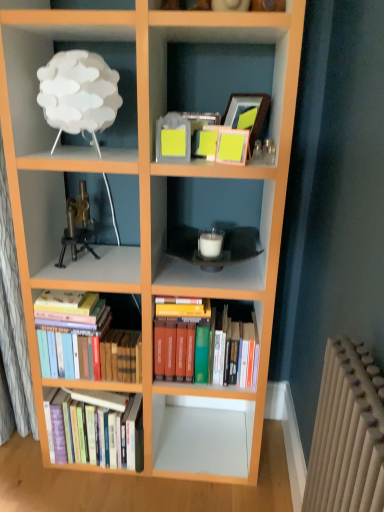
Question: Is hardcover books at lower left, arranged as the third book when viewed from the right, closer to camera compared to hardcover books at center, the third book positioned from the left?

Choices:
 (A) no
 (B) yes

Answer: (A)

Question: Does hardcover books at lower left, arranged as the third book when viewed from the right, have a larger size compared to hardcover books at center, the first book viewed from the right?

Choices:
 (A) no
 (B) yes

Answer: (A)

Question: Is hardcover books at lower left, the first book positioned from the left, not near hardcover books at center, the first book viewed from the right?

Choices:
 (A) yes
 (B) no

Answer: (B)

Question: From the image's perspective, does hardcover books at lower left, the first book positioned from the left, appear lower than hardcover books at center, the first book viewed from the right?

Choices:
 (A) yes
 (B) no

Answer: (A)

Question: From the image's perspective, would you say hardcover books at lower left, arranged as the third book when viewed from the right, is positioned over hardcover books at center, the third book positioned from the left?

Choices:
 (A) yes
 (B) no

Answer: (B)

Question: From a real-world perspective, is white matte lamp at upper left positioned above or below hardcover books at lower left, the first book positioned from the left?

Choices:
 (A) above
 (B) below

Answer: (A)

Question: Looking at the image, does white matte lamp at upper left seem bigger or smaller compared to hardcover books at lower left, arranged as the third book when viewed from the right?

Choices:
 (A) small
 (B) big

Answer: (A)

Question: Visually, is white matte lamp at upper left positioned to the left or to the right of hardcover books at lower left, arranged as the third book when viewed from the right?

Choices:
 (A) left
 (B) right

Answer: (B)

Question: Is white matte lamp at upper left taller or shorter than hardcover books at lower left, the first book positioned from the left?

Choices:
 (A) tall
 (B) short

Answer: (B)

Question: From the image's perspective, is brass/bronze tripod at center-left above or below hardcover books at lower left, arranged as the 2th book when viewed from the left?

Choices:
 (A) below
 (B) above

Answer: (B)

Question: Considering the positions of brass/bronze tripod at center-left and hardcover books at lower left, marked as the 2th book in a right-to-left arrangement, in the image, is brass/bronze tripod at center-left taller or shorter than hardcover books at lower left, marked as the 2th book in a right-to-left arrangement,?

Choices:
 (A) short
 (B) tall

Answer: (A)

Question: In the image, is brass/bronze tripod at center-left positioned in front of or behind hardcover books at lower left, arranged as the 2th book when viewed from the left?

Choices:
 (A) front
 (B) behind

Answer: (A)

Question: In the image, is brass/bronze tripod at center-left on the left side or the right side of hardcover books at lower left, arranged as the 2th book when viewed from the left?

Choices:
 (A) left
 (B) right

Answer: (A)

Question: Considering the positions of hardcover books at lower left, arranged as the third book when viewed from the right, and brass/bronze tripod at center-left in the image, is hardcover books at lower left, arranged as the third book when viewed from the right, bigger or smaller than brass/bronze tripod at center-left?

Choices:
 (A) small
 (B) big

Answer: (B)

Question: From the image's perspective, relative to brass/bronze tripod at center-left, is hardcover books at lower left, arranged as the third book when viewed from the right, above or below?

Choices:
 (A) above
 (B) below

Answer: (B)